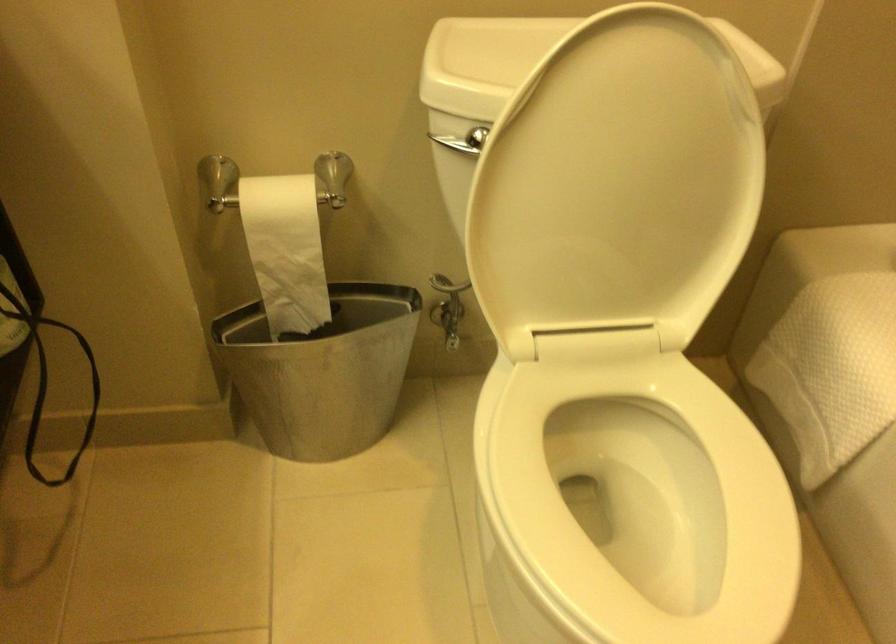
This screenshot has height=644, width=896. What do you see at coordinates (323, 371) in the screenshot?
I see `the metal trash bin` at bounding box center [323, 371].